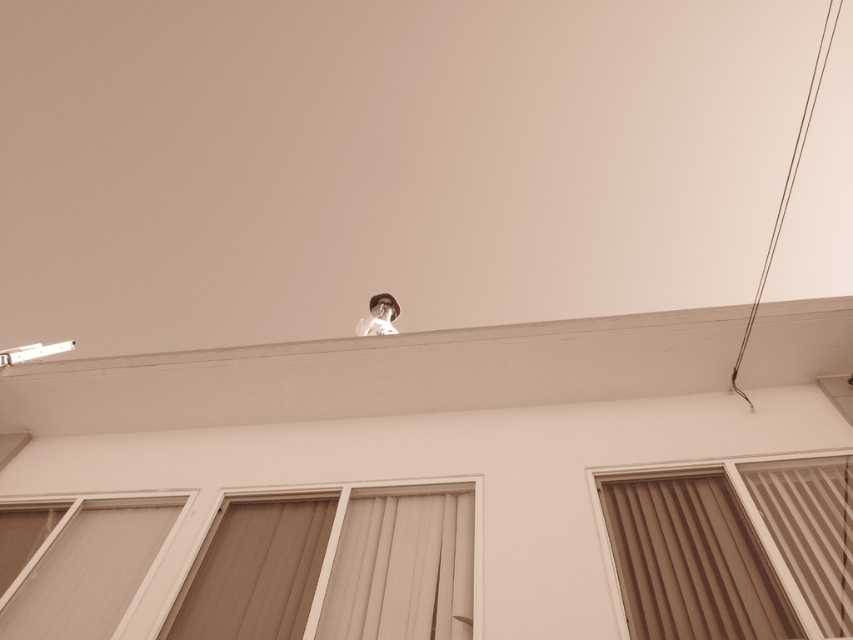
You are an interior designer assessing the layout of this room. You notice the beige textured curtain at center and the white glossy portrait at upper center. Which object is positioned higher up in the room?

The white glossy portrait at upper center is positioned higher up in the room than the beige textured curtain at center.

You are a photographer standing at the base of this building. You want to take a photo that includes both the matte glass window at lower left and the white glossy portrait at upper center. Which object will appear larger in your photo?

The matte glass window at lower left will appear larger in the photo because it is closer to the viewer than the white glossy portrait at upper center.